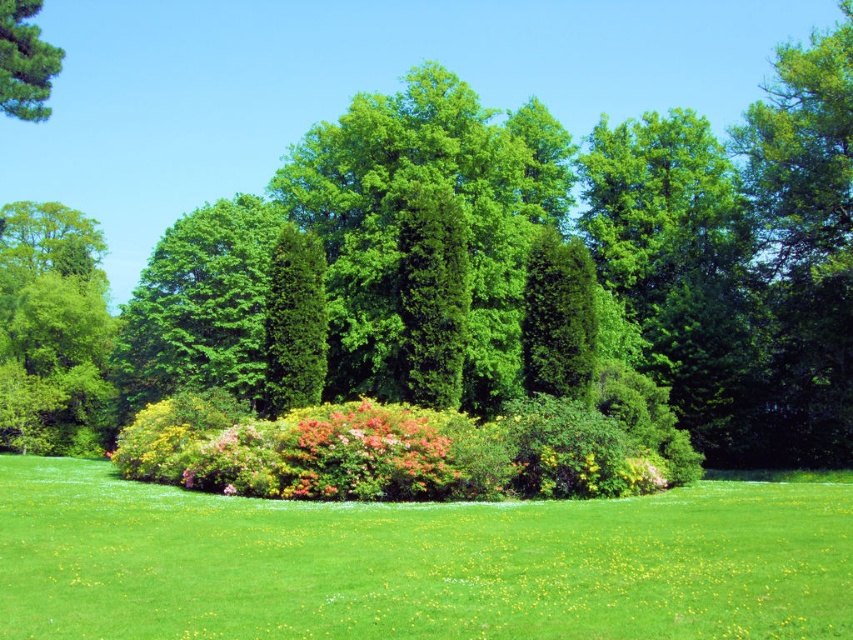
Question: Which object is farther from the camera taking this photo?

Choices:
 (A) vivid pink petals at center
 (B) green matte tree at upper left

Answer: (B)

Question: Where is vivid pink petals at center located in relation to green matte tree at upper left in the image?

Choices:
 (A) above
 (B) below

Answer: (B)

Question: Does vivid pink petals at center have a lesser width compared to green matte tree at upper left?

Choices:
 (A) yes
 (B) no

Answer: (B)

Question: From the image, what is the correct spatial relationship of vivid pink petals at center in relation to green matte tree at upper left?

Choices:
 (A) below
 (B) above

Answer: (A)

Question: Which point is farther to the camera?

Choices:
 (A) (38, 58)
 (B) (299, 458)

Answer: (A)

Question: Which point is farther from the camera taking this photo?

Choices:
 (A) (4, 76)
 (B) (454, 472)

Answer: (A)